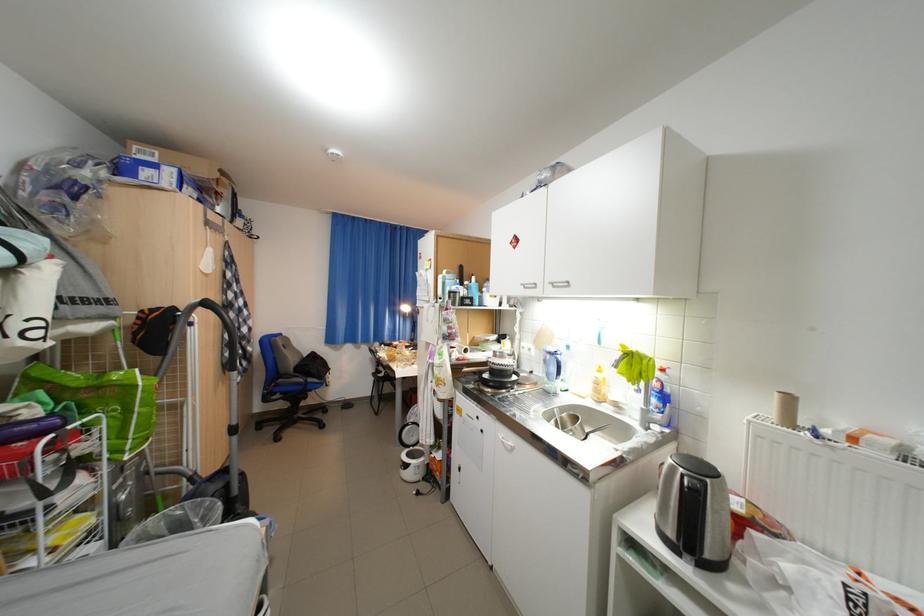
Find the location of a particular element. chair sitting surface is located at coordinates (293, 400).